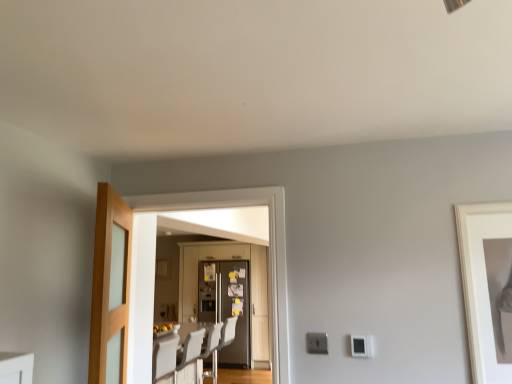
Question: From a real-world perspective, is metallic silver refrigerator at center, the 1th door in the back-to-front sequence, positioned over metallic gray refrigerator at center based on gravity?

Choices:
 (A) no
 (B) yes

Answer: (B)

Question: Is metallic silver refrigerator at center, the 1th door in the back-to-front sequence, behind metallic gray refrigerator at center?

Choices:
 (A) yes
 (B) no

Answer: (A)

Question: Is metallic silver refrigerator at center, placed as the third door when sorted from front to back, oriented away from metallic gray refrigerator at center?

Choices:
 (A) yes
 (B) no

Answer: (A)

Question: Is metallic silver refrigerator at center, placed as the third door when sorted from front to back, surrounding metallic gray refrigerator at center?

Choices:
 (A) yes
 (B) no

Answer: (A)

Question: Does metallic silver refrigerator at center, placed as the third door when sorted from front to back, turn towards metallic gray refrigerator at center?

Choices:
 (A) yes
 (B) no

Answer: (A)

Question: From the image's perspective, is white plastic swivel chair at center positioned above or below light wood/glass door at left, which is the 3th door from back to front?

Choices:
 (A) below
 (B) above

Answer: (A)

Question: Considering the positions of white plastic swivel chair at center and light wood/glass door at left, which is the first door from front to back, in the image, is white plastic swivel chair at center taller or shorter than light wood/glass door at left, which is the first door from front to back,?

Choices:
 (A) short
 (B) tall

Answer: (B)

Question: Relative to light wood/glass door at left, which is the first door from front to back, is white plastic swivel chair at center in front or behind?

Choices:
 (A) front
 (B) behind

Answer: (B)

Question: Looking at their shapes, would you say white plastic swivel chair at center is wider or thinner than light wood/glass door at left, which is the 3th door from back to front?

Choices:
 (A) thin
 (B) wide

Answer: (B)

Question: Would you say metallic gray refrigerator at center is inside or outside white plastic swivel chair at center?

Choices:
 (A) outside
 (B) inside

Answer: (A)

Question: Based on their sizes in the image, would you say metallic gray refrigerator at center is bigger or smaller than white plastic swivel chair at center?

Choices:
 (A) small
 (B) big

Answer: (B)

Question: Is metallic gray refrigerator at center wider or thinner than white plastic swivel chair at center?

Choices:
 (A) thin
 (B) wide

Answer: (B)

Question: From their relative heights in the image, would you say metallic gray refrigerator at center is taller or shorter than white plastic swivel chair at center?

Choices:
 (A) tall
 (B) short

Answer: (A)

Question: From the image's perspective, is white plastic light switch at lower right above or below white glossy dining table at center?

Choices:
 (A) above
 (B) below

Answer: (A)

Question: Is white plastic light switch at lower right taller or shorter than white glossy dining table at center?

Choices:
 (A) tall
 (B) short

Answer: (B)